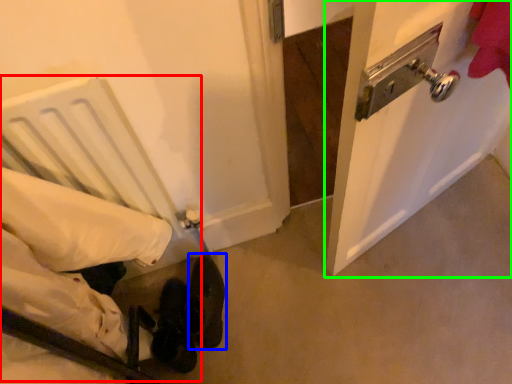
Question: Which is farther away from bed (highlighted by a red box)? footwear (highlighted by a blue box) or door (highlighted by a green box)?

Choices:
 (A) footwear
 (B) door

Answer: (B)